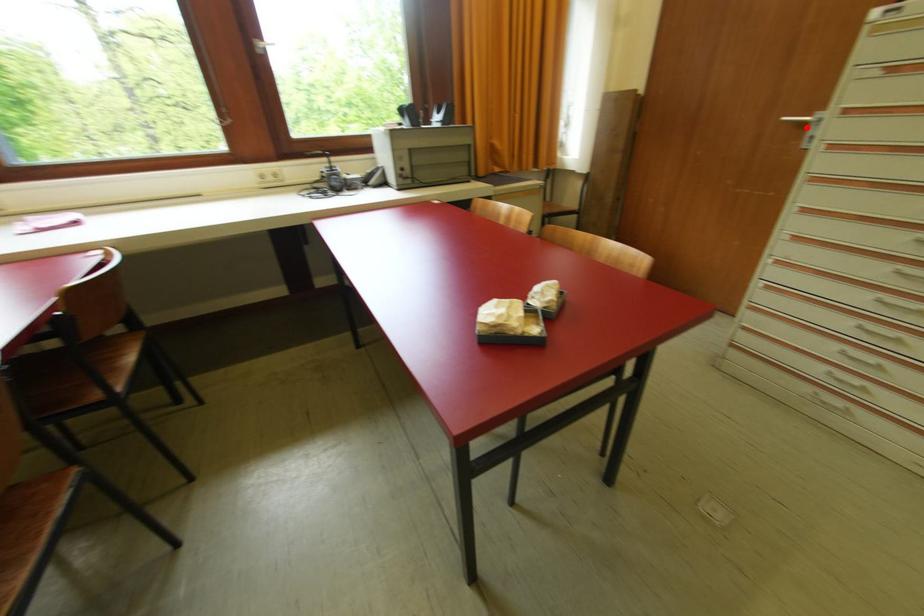
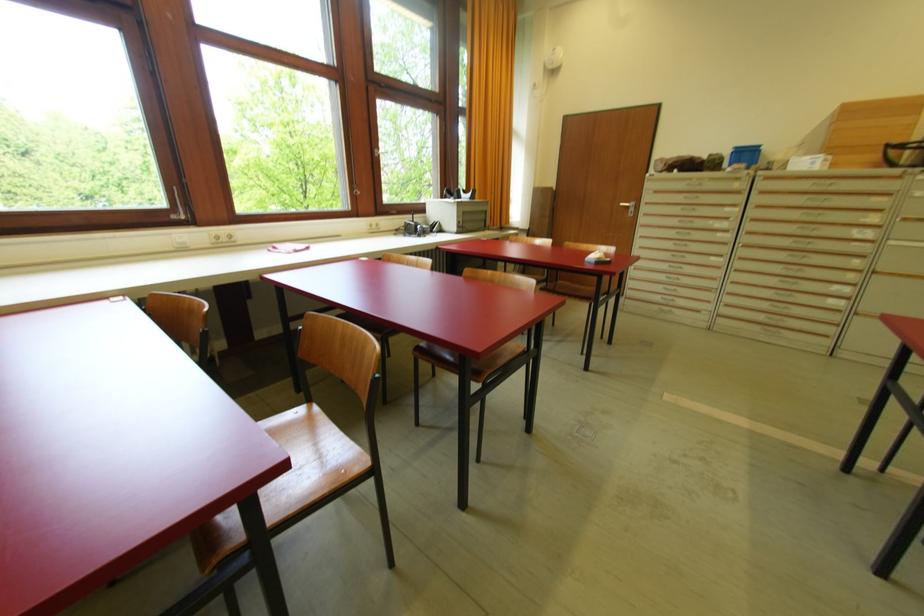
Where in the second image is the point corresponding to the highlighted location from the first image?

(629, 209)